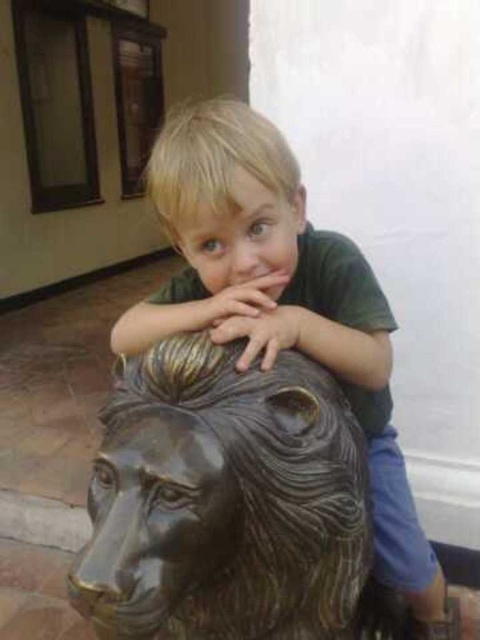
Which is behind, point (192, 493) or point (248, 328)?

The point (248, 328) is behind.

Is bronze textured lion head at center above matte green shirt at center?

Correct, bronze textured lion head at center is located above matte green shirt at center.

Does point (199, 428) come in front of point (441, 572)?

Yes, point (199, 428) is closer to viewer.

This screenshot has height=640, width=480. I want to click on bronze textured lion head at center, so click(x=224, y=500).